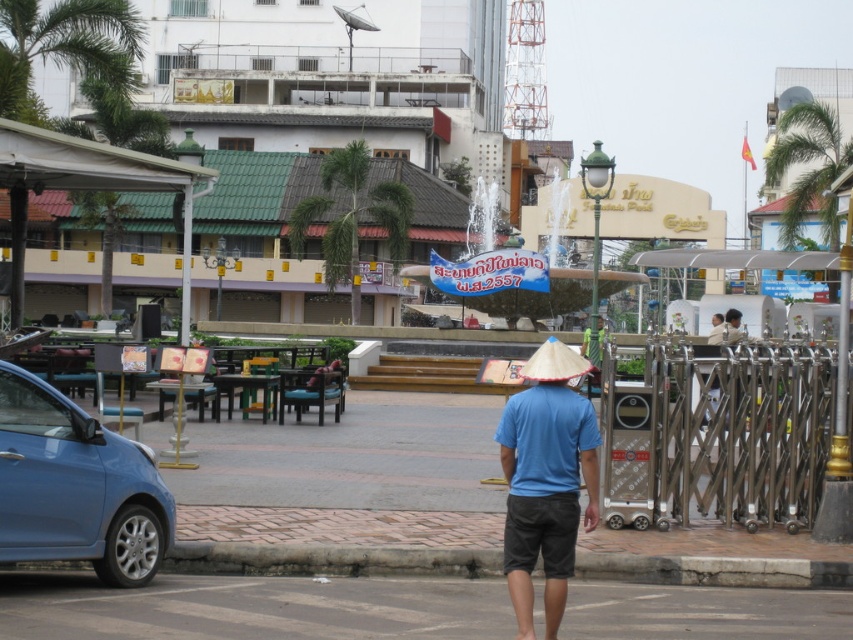
Question: Which object appears farthest from the camera in this image?

Choices:
 (A) green leafy palm tree at left
 (B) green leafy palm tree at upper right

Answer: (B)

Question: Does blue cotton shirt at center have a smaller size compared to green leafy palm tree at upper right?

Choices:
 (A) yes
 (B) no

Answer: (A)

Question: Which object is positioned farthest from the green leafy palm tree at upper right?

Choices:
 (A) gray asphalt pavement at center
 (B) green leafy palm tree at left
 (C) green leafy palm tree at upper left
 (D) blue metallic car at lower left

Answer: (A)

Question: Does gray asphalt pavement at center have a larger size compared to natural straw hat at center?

Choices:
 (A) no
 (B) yes

Answer: (A)

Question: Where is green leafy palm tree at upper right located in relation to natural straw hat at center in the image?

Choices:
 (A) above
 (B) below

Answer: (A)

Question: Which point appears farthest from the camera in this image?

Choices:
 (A) (148, 538)
 (B) (123, 202)
 (C) (569, 513)
 (D) (535, 376)

Answer: (B)